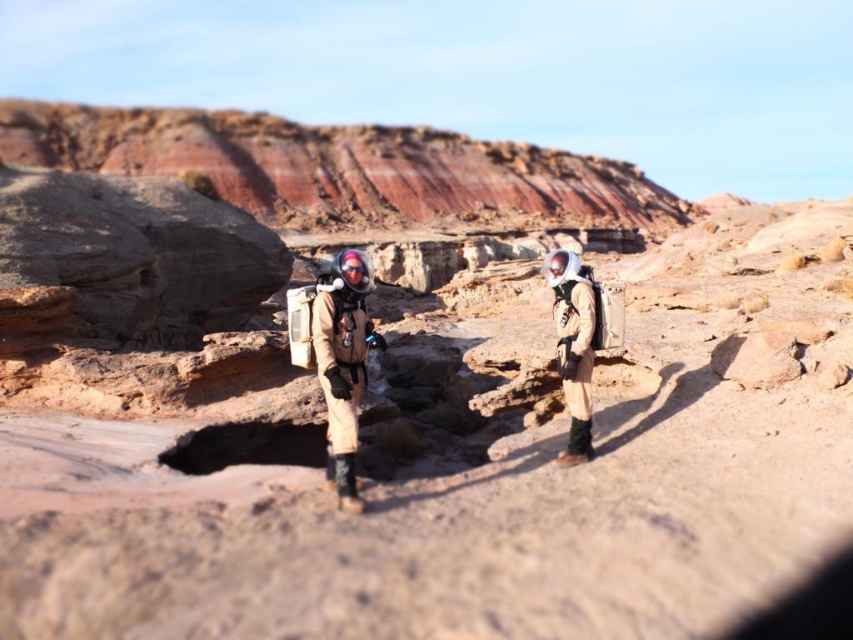
Question: Does tan fabric spacesuit at center lie behind matte beige spacesuit at right?

Choices:
 (A) yes
 (B) no

Answer: (B)

Question: Which point is closer to the camera taking this photo?

Choices:
 (A) (572, 262)
 (B) (347, 476)

Answer: (B)

Question: Among these objects, which one is farthest from the camera?

Choices:
 (A) matte beige spacesuit at right
 (B) tan fabric spacesuit at center

Answer: (A)

Question: Does tan fabric spacesuit at center have a larger size compared to matte beige spacesuit at right?

Choices:
 (A) no
 (B) yes

Answer: (A)

Question: Considering the relative positions of tan fabric spacesuit at center and matte beige spacesuit at right in the image provided, where is tan fabric spacesuit at center located with respect to matte beige spacesuit at right?

Choices:
 (A) right
 (B) left

Answer: (B)